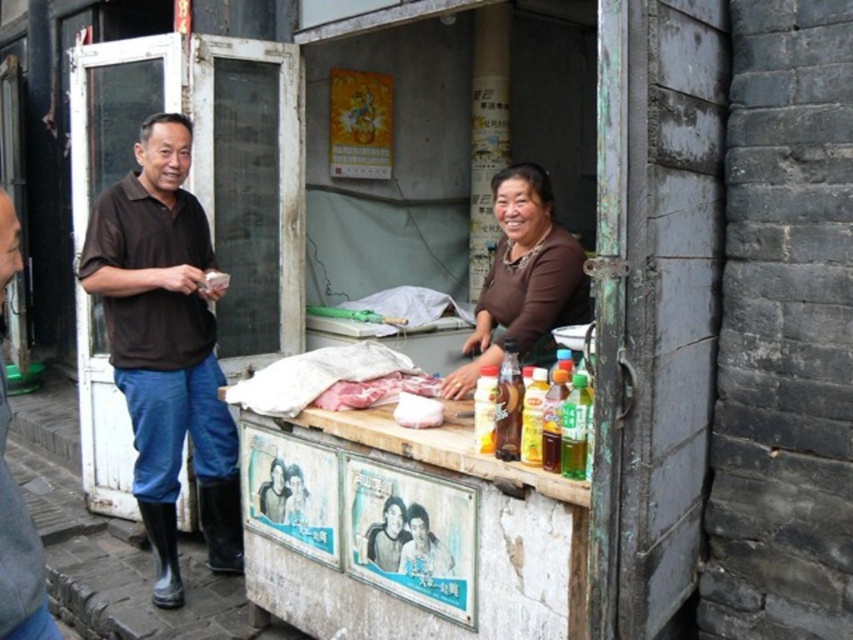
Can you confirm if brown cotton shirt at left is wider than matte plastic poster at center?

Correct, the width of brown cotton shirt at left exceeds that of matte plastic poster at center.

Is brown cotton shirt at left taller than matte plastic poster at center?

Yes, brown cotton shirt at left is taller than matte plastic poster at center.

Who is more forward, (173,480) or (412,566)?

Point (412,566) is more forward.

Locate an element on the screen. The image size is (853, 640). brown cotton shirt at left is located at coordinates (166, 346).

In the scene shown: Who is positioned more to the left, brown cotton shirt at left or brown leather jacket at left?

brown cotton shirt at left

Which is in front, point (158, 524) or point (16, 540)?

Point (16, 540) is in front.

Find the location of a particular element. The height and width of the screenshot is (640, 853). brown cotton shirt at left is located at coordinates (166, 346).

Is brown matte shirt at center taller than brown leather jacket at left?

No, brown matte shirt at center is not taller than brown leather jacket at left.

Is brown matte shirt at center in front of brown leather jacket at left?

No.

Between point (552, 224) and point (3, 403), which one is positioned behind?

The point (552, 224) is behind.

The height and width of the screenshot is (640, 853). Identify the location of brown matte shirt at center. (523, 275).